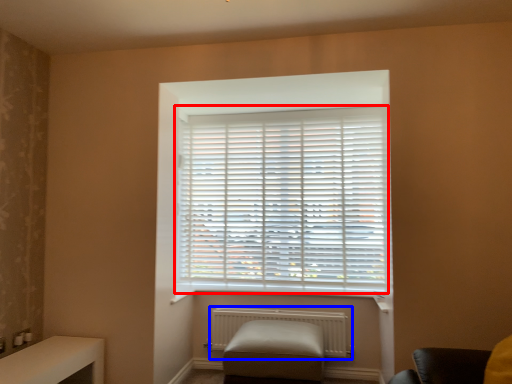
Question: Which point is closer to the camera, window blind (highlighted by a red box) or radiator (highlighted by a blue box)?

Choices:
 (A) window blind
 (B) radiator

Answer: (B)